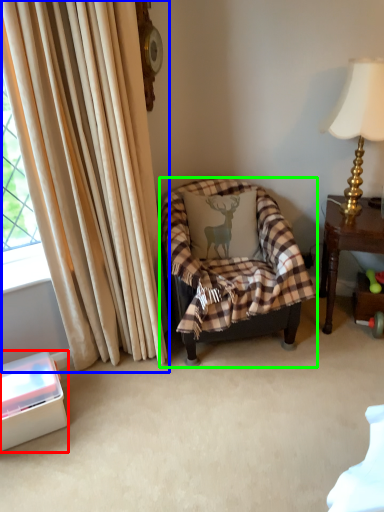
Question: Considering the real-world distances, which object is closest to box (highlighted by a red box)? curtain (highlighted by a blue box) or chair (highlighted by a green box).

Choices:
 (A) curtain
 (B) chair

Answer: (A)